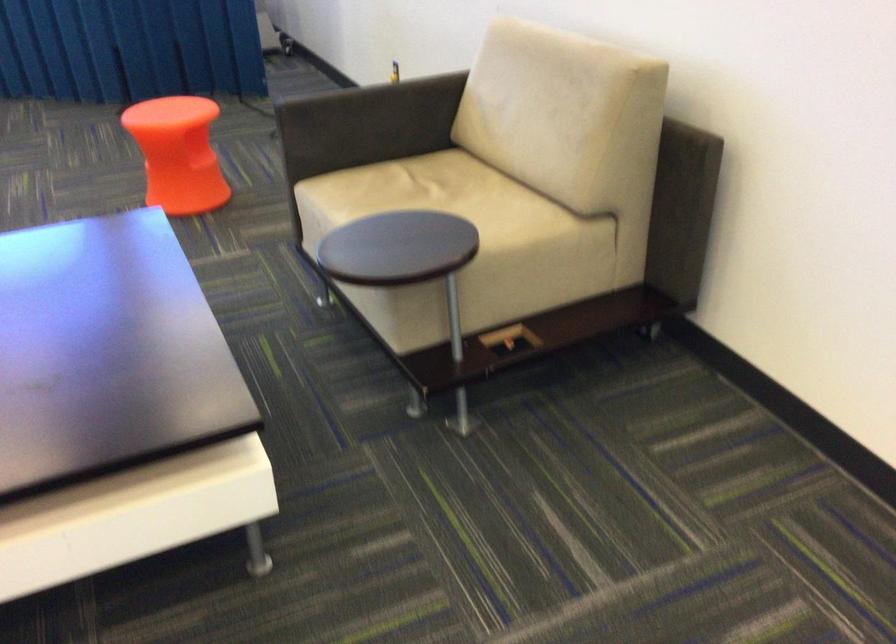
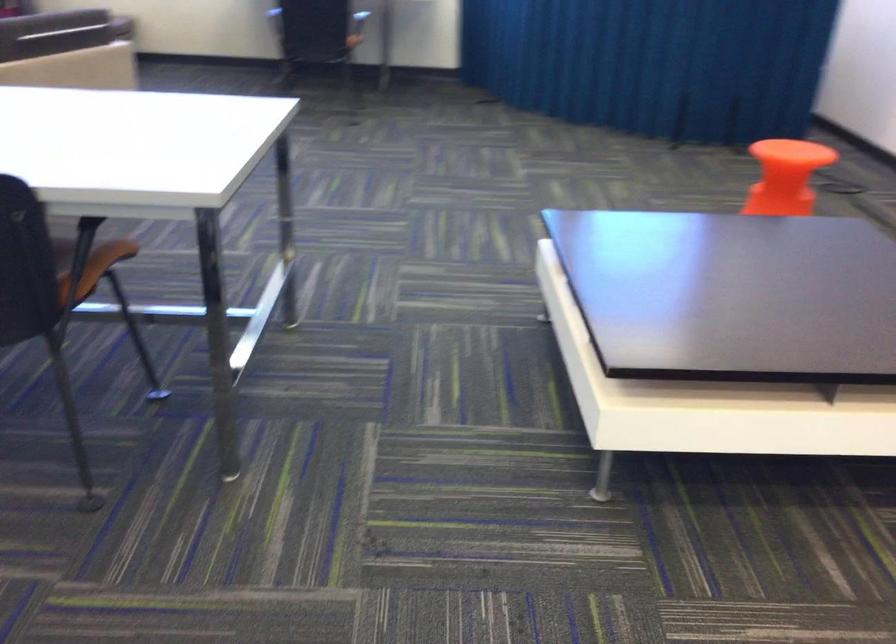
Find the pixel in the second image that matches point 148,154 in the first image.

(785, 176)